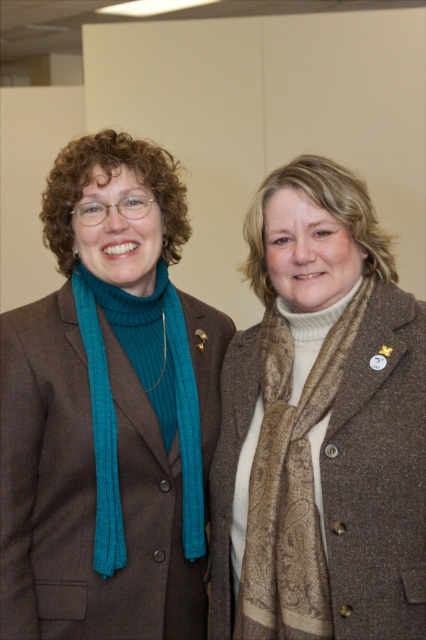
Question: Which object appears farthest from the camera in this image?

Choices:
 (A) teal ribbed scarf at left
 (B) teal knitted scarf at left

Answer: (A)

Question: Which object is farther from the camera taking this photo?

Choices:
 (A) brown paisley scarf at center
 (B) teal knitted scarf at left
 (C) teal ribbed scarf at left

Answer: (C)

Question: Is brown paisley scarf at center to the left of teal ribbed scarf at left from the viewer's perspective?

Choices:
 (A) yes
 (B) no

Answer: (B)

Question: Can you confirm if teal knitted scarf at left is positioned above brown paisley scarf at center?

Choices:
 (A) no
 (B) yes

Answer: (B)

Question: Which of the following is the closest to the observer?

Choices:
 (A) (325, 579)
 (B) (77, 280)
 (C) (140, 552)

Answer: (A)

Question: Is teal knitted scarf at left smaller than teal ribbed scarf at left?

Choices:
 (A) no
 (B) yes

Answer: (A)